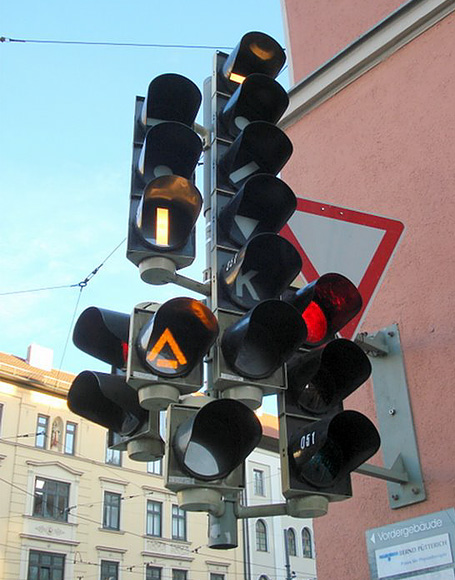
Locate an element on the screen. The height and width of the screenshot is (580, 455). red lights is located at coordinates (122, 351), (308, 326).